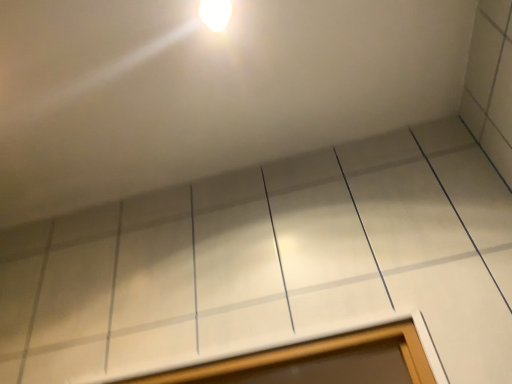
Question: Is white glossy light fixture at upper center shorter than white glossy window at lower center?

Choices:
 (A) yes
 (B) no

Answer: (A)

Question: Considering the relative sizes of white glossy light fixture at upper center and white glossy window at lower center in the image provided, is white glossy light fixture at upper center taller than white glossy window at lower center?

Choices:
 (A) yes
 (B) no

Answer: (B)

Question: Is white glossy light fixture at upper center smaller than white glossy window at lower center?

Choices:
 (A) no
 (B) yes

Answer: (B)

Question: Is white glossy light fixture at upper center wider than white glossy window at lower center?

Choices:
 (A) no
 (B) yes

Answer: (B)

Question: From the image's perspective, is white glossy light fixture at upper center on white glossy window at lower center?

Choices:
 (A) yes
 (B) no

Answer: (A)

Question: From a real-world perspective, is white glossy light fixture at upper center located beneath white glossy window at lower center?

Choices:
 (A) yes
 (B) no

Answer: (B)

Question: Is white glossy window at lower center with white glossy light fixture at upper center?

Choices:
 (A) no
 (B) yes

Answer: (A)

Question: Considering the relative sizes of white glossy window at lower center and white glossy light fixture at upper center in the image provided, is white glossy window at lower center shorter than white glossy light fixture at upper center?

Choices:
 (A) yes
 (B) no

Answer: (B)

Question: Is white glossy window at lower center not close to white glossy light fixture at upper center?

Choices:
 (A) yes
 (B) no

Answer: (B)

Question: From a real-world perspective, is white glossy window at lower center over white glossy light fixture at upper center?

Choices:
 (A) yes
 (B) no

Answer: (B)

Question: Is white glossy window at lower center facing towards white glossy light fixture at upper center?

Choices:
 (A) no
 (B) yes

Answer: (A)

Question: Is white glossy window at lower center oriented away from white glossy light fixture at upper center?

Choices:
 (A) yes
 (B) no

Answer: (B)

Question: Looking at the image, does white glossy window at lower center seem bigger or smaller compared to white glossy light fixture at upper center?

Choices:
 (A) big
 (B) small

Answer: (A)